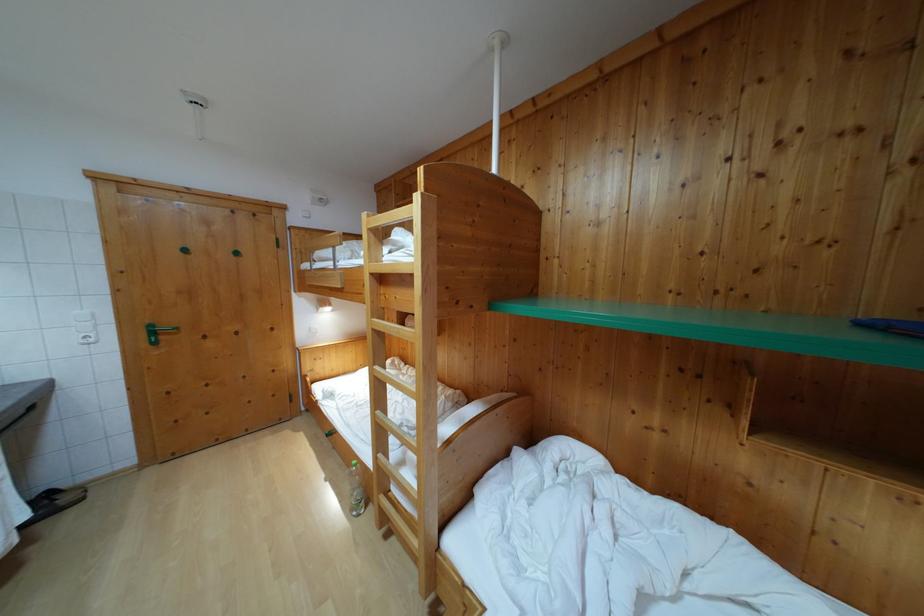
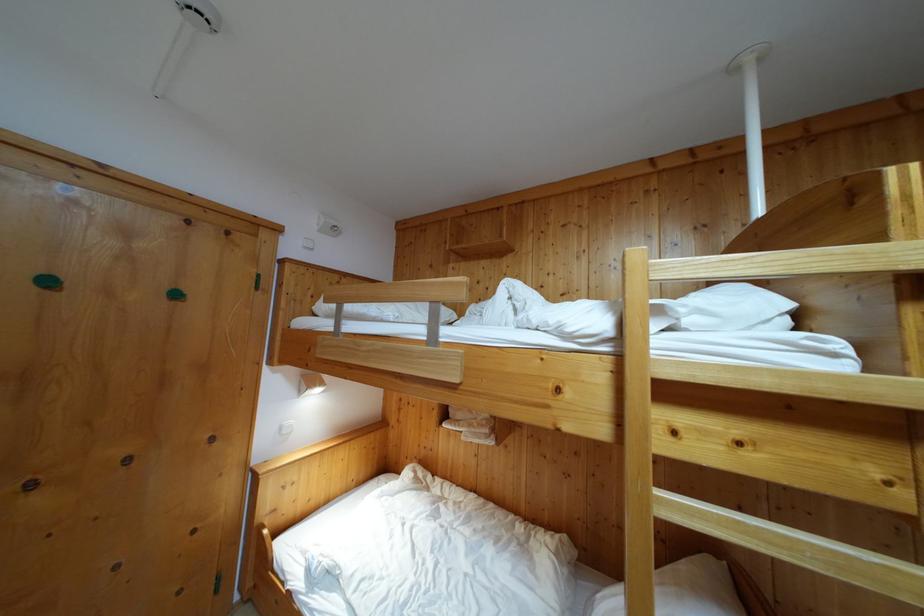
Find the pixel in the second image that matches [313,336] in the first image.

(285, 435)